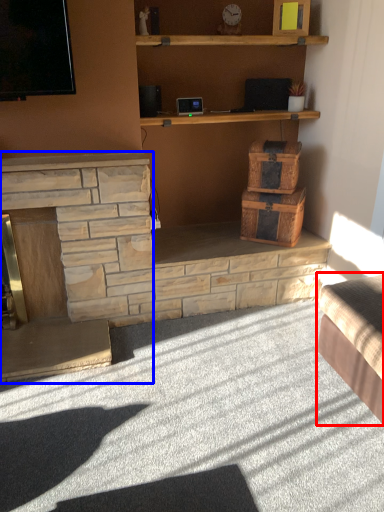
Question: Which of the following is the closest to the observer, studio couch (highlighted by a red box) or fireplace (highlighted by a blue box)?

Choices:
 (A) studio couch
 (B) fireplace

Answer: (A)